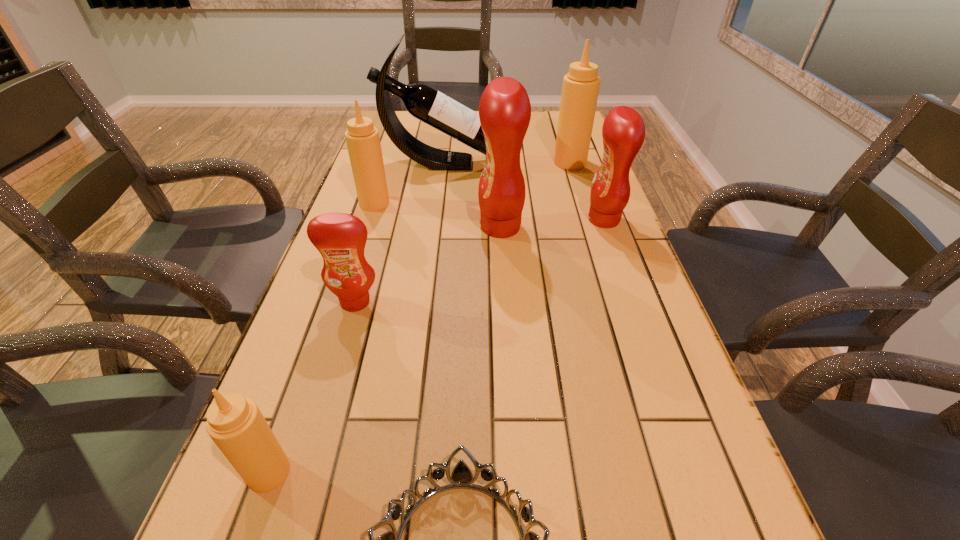
Identify the location of the smallest tan condiment. (236, 425).

Find the location of a particular element. The height and width of the screenshot is (540, 960). vacant space located 0.090m on the stand of the black wine bottle is located at coordinates (532, 163).

Where is `free location located 0.360m on the label side of the second red condiment from right to left`? free location located 0.360m on the label side of the second red condiment from right to left is located at coordinates (346, 227).

Where is `free location located 0.250m on the label side of the second red condiment from right to left`? free location located 0.250m on the label side of the second red condiment from right to left is located at coordinates (386, 227).

This screenshot has width=960, height=540. I want to click on free space located on the label side of the second red condiment from right to left, so click(x=360, y=227).

Find the location of a particular element. The width and height of the screenshot is (960, 540). free space located 0.210m on the left of the biggest tan condiment is located at coordinates (491, 163).

Where is `free space located 0.090m on the right of the second nearest tan condiment`? free space located 0.090m on the right of the second nearest tan condiment is located at coordinates (420, 204).

This screenshot has width=960, height=540. Identify the location of free region located on the label side of the rightmost red condiment. (474, 220).

Locate an element on the screen. This screenshot has height=540, width=960. blank area located 0.320m on the label side of the rightmost red condiment is located at coordinates (471, 220).

Locate an element on the screen. vacant space located on the label side of the rightmost red condiment is located at coordinates (500, 220).